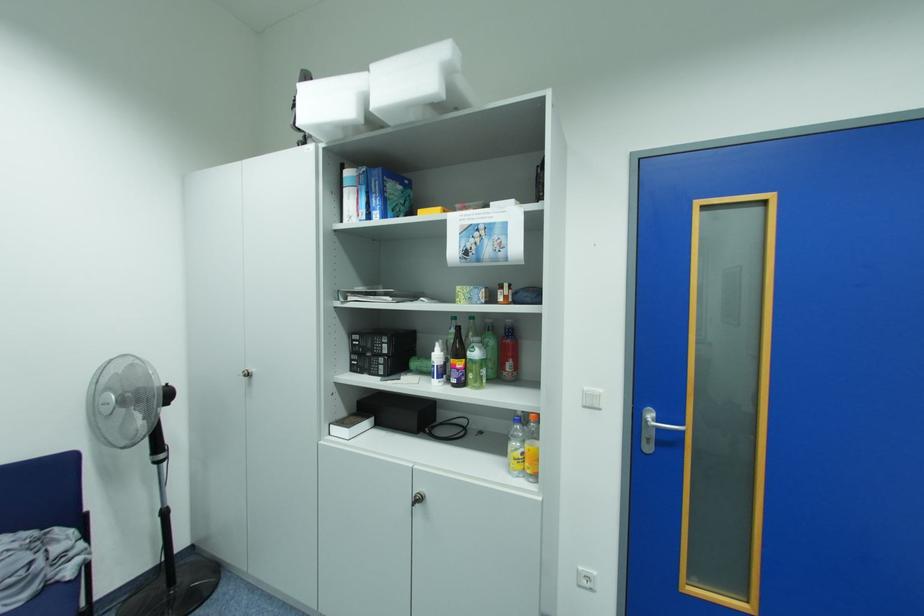
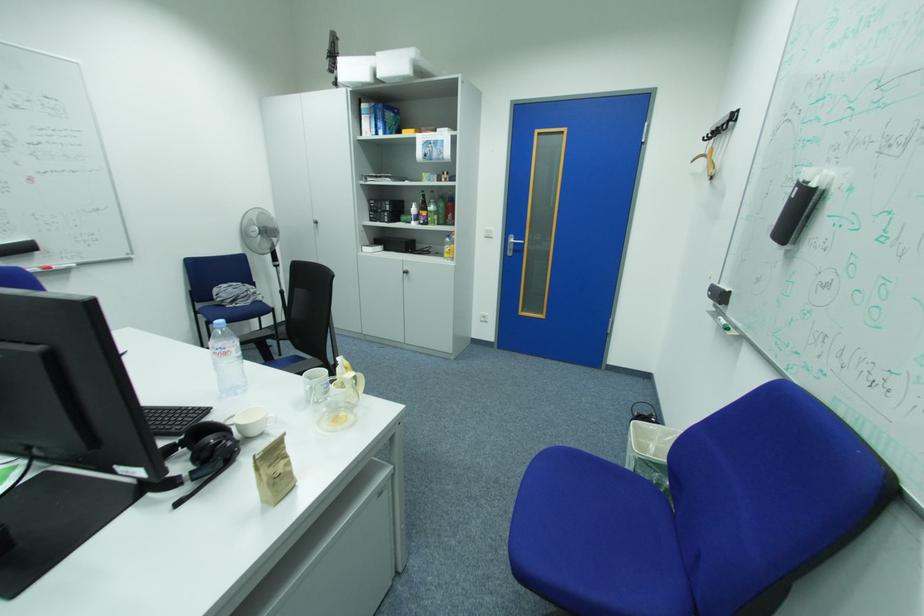
Question: The images are taken continuously from a first-person perspective. In which direction are you moving?

Choices:
 (A) Left
 (B) Right
 (C) Forward
 (D) Backward

Answer: (D)